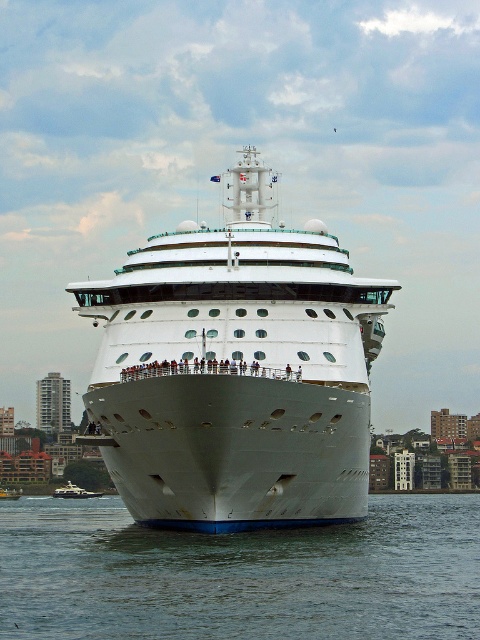
Between point (244, 458) and point (17, 490), which one is positioned in front?

Point (244, 458)

Can you confirm if white glossy cruise ship at center is positioned below white glossy boat at center?

No.

Is point (297, 362) in front of point (6, 493)?

Yes, it is.

This screenshot has width=480, height=640. I want to click on white glossy cruise ship at center, so click(x=236, y=371).

Does white glossy cruise ship at center have a lesser height compared to white matte water at center?

Incorrect, white glossy cruise ship at center's height does not fall short of white matte water at center's.

Who is more forward, [337,396] or [360,588]?

Point [360,588]

Who is more forward, (x=240, y=388) or (x=348, y=611)?

Point (x=348, y=611) is more forward.

This screenshot has width=480, height=640. Identify the location of white glossy cruise ship at center. [236, 371].

Is white matte boat at lower center to the right of white glossy boat at center from the viewer's perspective?

Yes, white matte boat at lower center is to the right of white glossy boat at center.

Does white matte boat at lower center have a lesser width compared to white glossy boat at center?

Incorrect, white matte boat at lower center's width is not less than white glossy boat at center's.

The width and height of the screenshot is (480, 640). What do you see at coordinates (74, 492) in the screenshot?
I see `white matte boat at lower center` at bounding box center [74, 492].

The width and height of the screenshot is (480, 640). Identify the location of white matte boat at lower center. (74, 492).